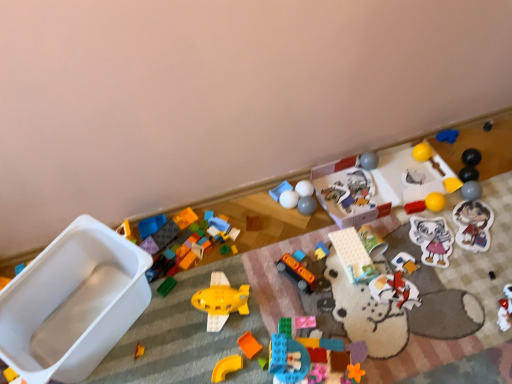
The height and width of the screenshot is (384, 512). Find the location of `vacant space that is in between orange plastic block at lower left, acting as the 23th toy starting from the right, and yellow plastic curve at center, the fifth toy in the left-to-right sequence`. vacant space that is in between orange plastic block at lower left, acting as the 23th toy starting from the right, and yellow plastic curve at center, the fifth toy in the left-to-right sequence is located at coordinates (183, 360).